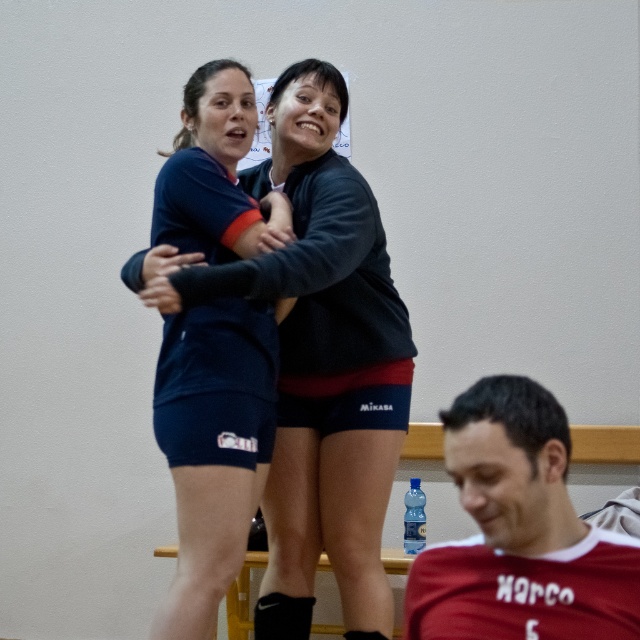
Is dark blue jersey at center shorter than red jersey at lower right?

No, dark blue jersey at center is not shorter than red jersey at lower right.

Consider the image. Between dark blue jersey at center and red jersey at lower right, which one is positioned higher?

dark blue jersey at center is higher up.

Describe the element at coordinates (321, 362) in the screenshot. This screenshot has width=640, height=640. I see `dark blue jersey at center` at that location.

Identify the location of dark blue jersey at center. This screenshot has height=640, width=640. (321, 362).